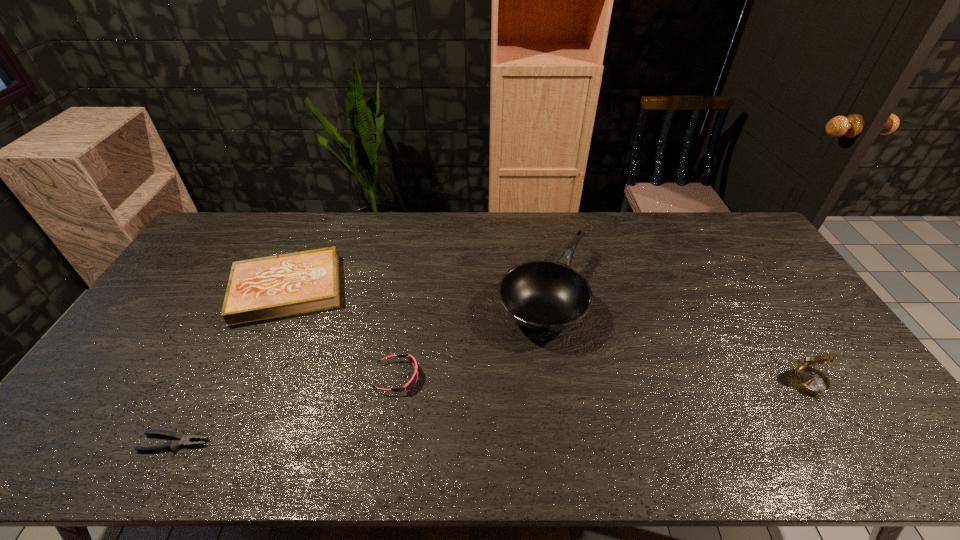
Where is `vacant region between the second object from right to left and the second shortest object`? This screenshot has height=540, width=960. vacant region between the second object from right to left and the second shortest object is located at coordinates (470, 336).

Where is `vacant region between the shortest object and the hardback book`? Image resolution: width=960 pixels, height=540 pixels. vacant region between the shortest object and the hardback book is located at coordinates (231, 366).

The image size is (960, 540). Identify the location of blank region between the third object from left to right and the frying pan. (470, 336).

Locate an element on the screen. free space between the fourth object from left to right and the fourth tallest object is located at coordinates (470, 336).

The image size is (960, 540). In order to click on free point between the goggles and the rightmost object in this screenshot , I will do `click(604, 381)`.

Identify the location of free space between the rightmost object and the third shortest object. The width and height of the screenshot is (960, 540). (548, 337).

Where is `free point between the rightmost object and the frying pan`? The height and width of the screenshot is (540, 960). free point between the rightmost object and the frying pan is located at coordinates (677, 340).

Image resolution: width=960 pixels, height=540 pixels. I want to click on vacant area that lies between the rightmost object and the pliers, so click(492, 414).

You are a GUI agent. You are given a task and a screenshot of the screen. Output one action in this format:
    pyautogui.click(x=<x>, y=<y>)
    Task: Click on the free space between the hardback book and the second object from right to left
    The height and width of the screenshot is (540, 960).
    Given the screenshot: What is the action you would take?
    pyautogui.click(x=416, y=292)

Select which object is the closest to the nearest object. Please provide its 2D coordinates. Your answer should be formatted as a tuple, i.e. [(x, y)], where the tuple contains the x and y coordinates of a point satisfying the conditions above.

[(259, 289)]